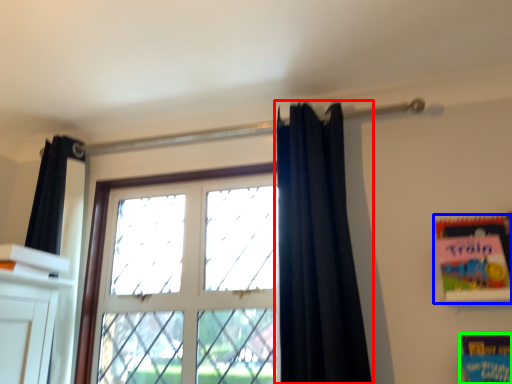
Question: Which is nearer to the curtain (highlighted by a red box)? paperback book (highlighted by a blue box) or paperback book (highlighted by a green box).

Choices:
 (A) paperback book
 (B) paperback book

Answer: (A)